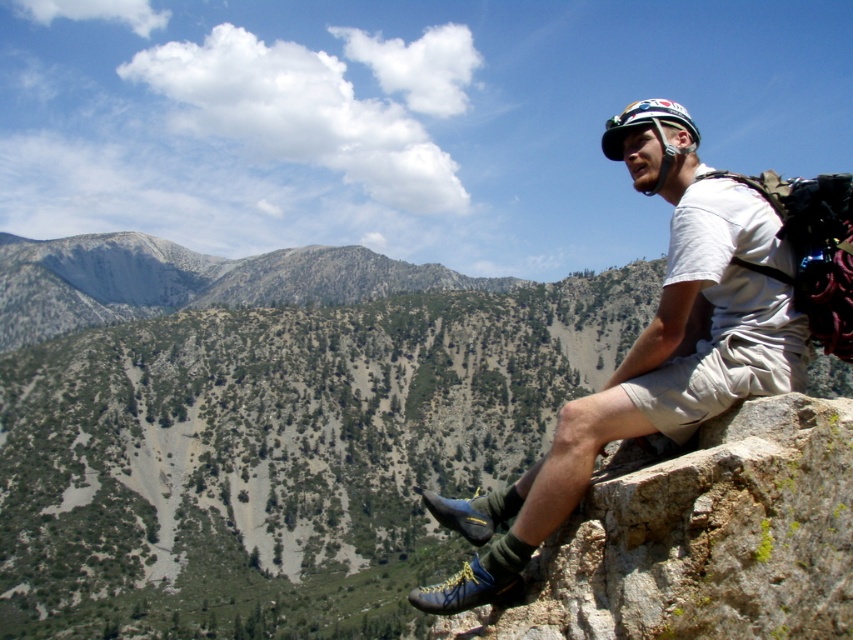
Does brown rough rock at lower right come in front of matte white helmet at upper right?

Yes, brown rough rock at lower right is closer to the viewer.

Between brown rough rock at lower right and matte white helmet at upper right, which one has less height?

Standing shorter between the two is brown rough rock at lower right.

I want to click on brown rough rock at lower right, so click(701, 538).